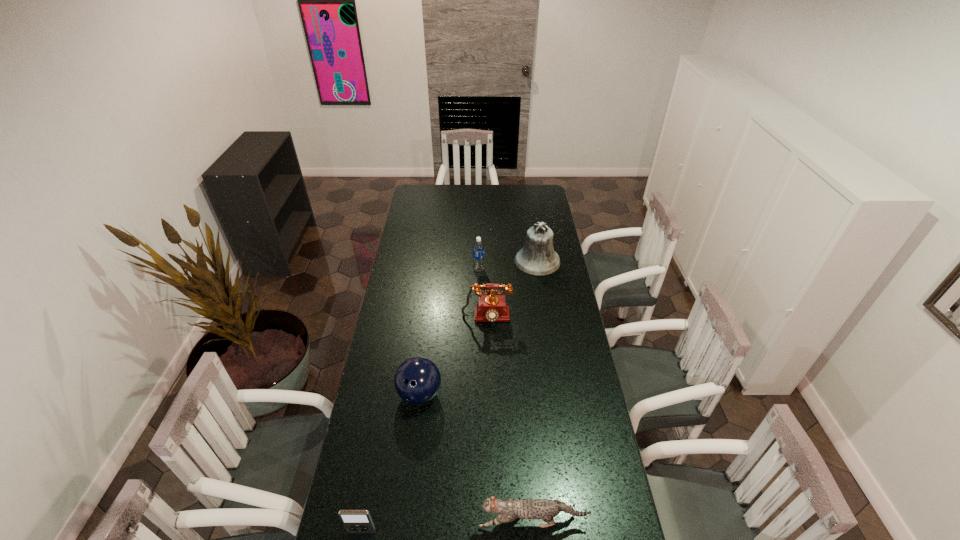
Where is `free location that satisfies the following two spatial constraints: 1. on the face of the cat; 2. on the front-facing side of the iPod`? The image size is (960, 540). free location that satisfies the following two spatial constraints: 1. on the face of the cat; 2. on the front-facing side of the iPod is located at coordinates (534, 531).